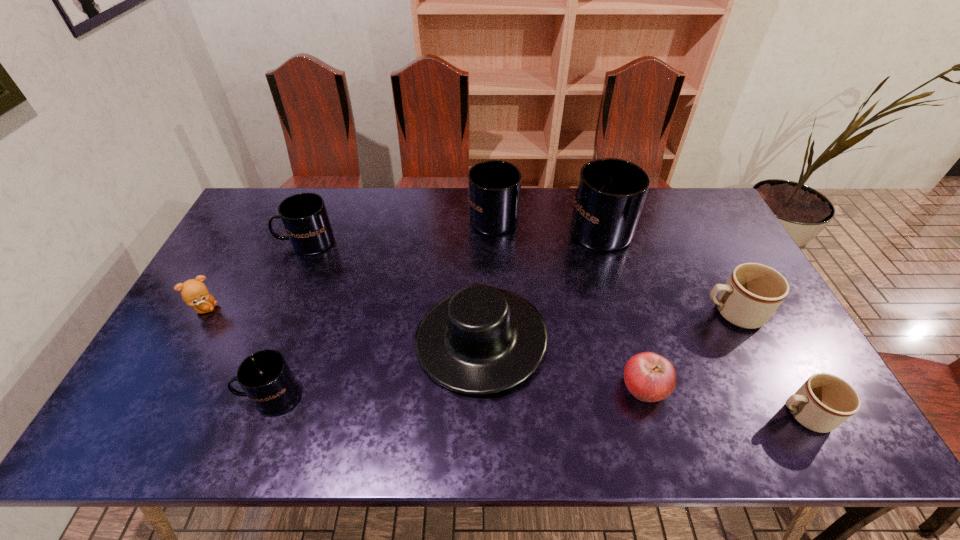
This screenshot has height=540, width=960. I want to click on the tallest object, so click(610, 194).

Find the location of a particular element. The width and height of the screenshot is (960, 540). the third mug from right to left is located at coordinates (610, 194).

Locate an element on the screen. This screenshot has height=540, width=960. the second tallest object is located at coordinates (494, 187).

In order to click on the third black mug from left to right in this screenshot , I will do `click(494, 187)`.

Where is `the second smallest black mug`? the second smallest black mug is located at coordinates (304, 216).

The width and height of the screenshot is (960, 540). In order to click on black dress hat in this screenshot , I will do `click(480, 340)`.

You are a GUI agent. You are given a task and a screenshot of the screen. Output one action in this format:
    pyautogui.click(x=<x>, y=<y>)
    Task: Click on the farther brown mug
    This screenshot has width=960, height=540.
    Given the screenshot: What is the action you would take?
    pyautogui.click(x=753, y=292)

Locate an element on the screen. Image resolution: width=960 pixels, height=540 pixels. the third nearest mug is located at coordinates (753, 292).

Where is `teddy bear`? This screenshot has height=540, width=960. teddy bear is located at coordinates (194, 293).

Image resolution: width=960 pixels, height=540 pixels. Find the location of `the leftmost object`. the leftmost object is located at coordinates (194, 293).